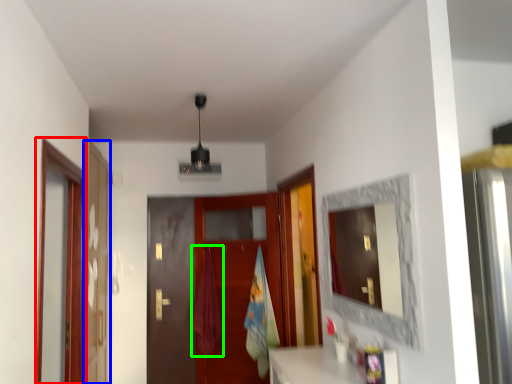
Question: Which object is the farthest from screen door (highlighted by a red box)? Choose among these: screen door (highlighted by a blue box) or curtain (highlighted by a green box).

Choices:
 (A) screen door
 (B) curtain

Answer: (B)